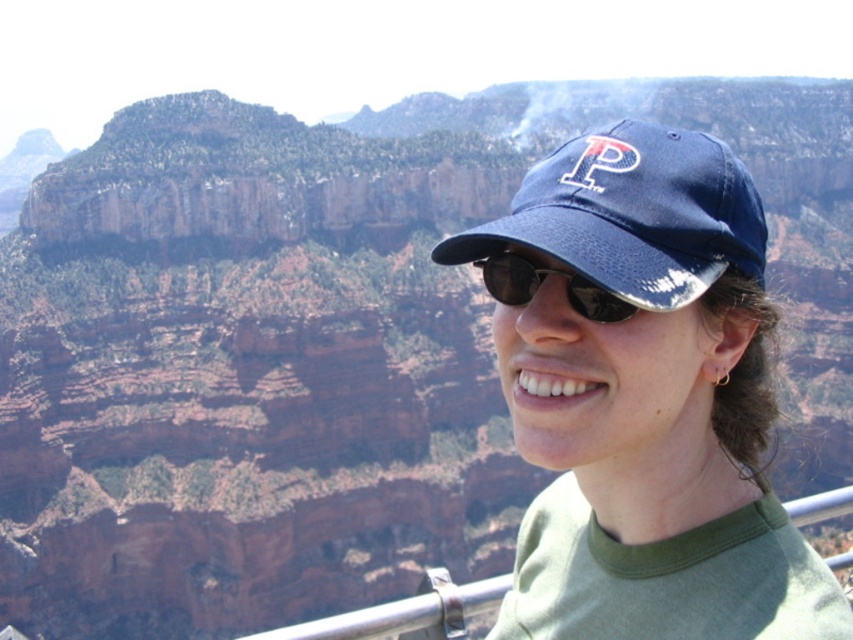
Question: Can you confirm if blue fabric cap at center is positioned to the left of sunglasses at center?

Choices:
 (A) yes
 (B) no

Answer: (B)

Question: Estimate the real-world distances between objects in this image. Which object is closer to the blue fabric cap at center?

Choices:
 (A) navy blue fabric baseball cap at upper center
 (B) sunglasses at center

Answer: (B)

Question: Which point is closer to the camera?

Choices:
 (A) pos(585,314)
 (B) pos(531,282)
 (C) pos(544,214)

Answer: (C)

Question: Is navy blue fabric baseball cap at upper center above sunglasses at center?

Choices:
 (A) no
 (B) yes

Answer: (B)

Question: Does blue fabric cap at center appear under navy blue fabric baseball cap at upper center?

Choices:
 (A) no
 (B) yes

Answer: (B)

Question: Which point is closer to the camera?

Choices:
 (A) blue fabric cap at center
 (B) navy blue fabric baseball cap at upper center

Answer: (A)